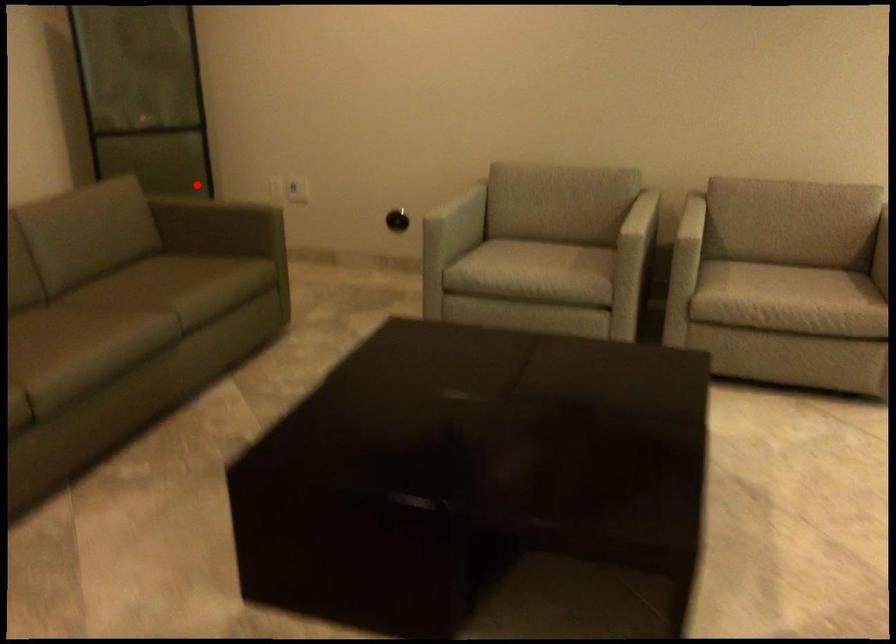
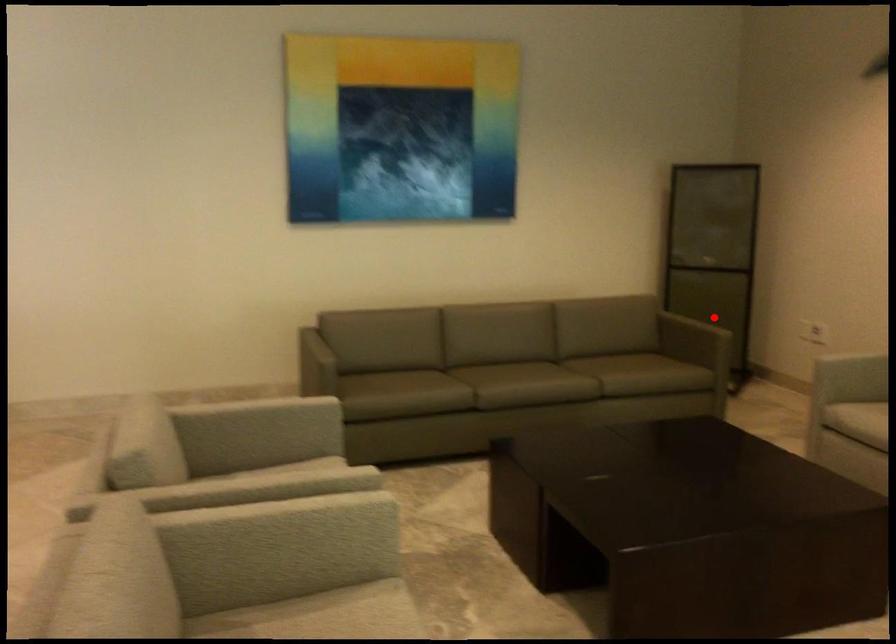
I am providing you with two images of the same scene from different viewpoints. A red point is marked on the first image and another point is marked on the second image. Does the point marked in image1 correspond to the same location as the one in image2?

Yes